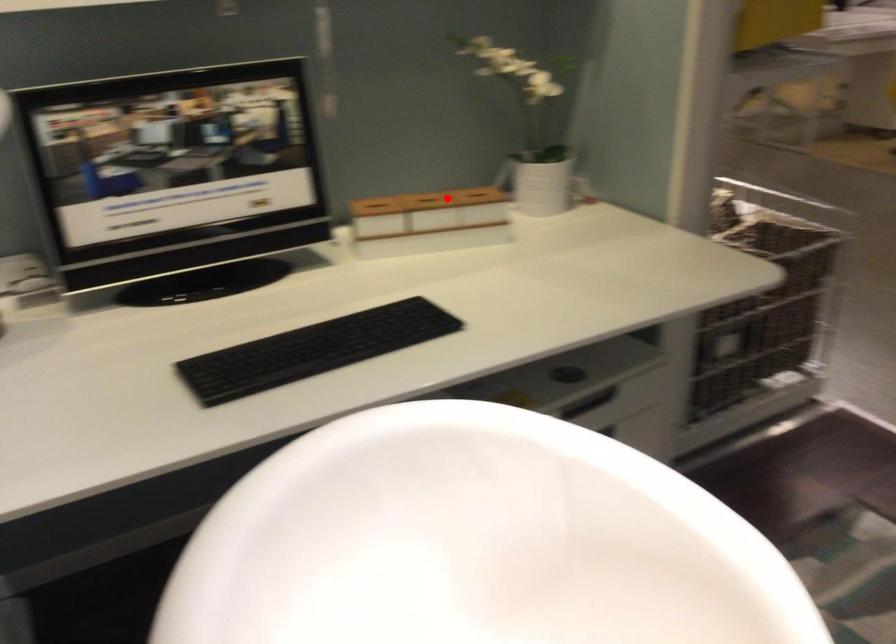
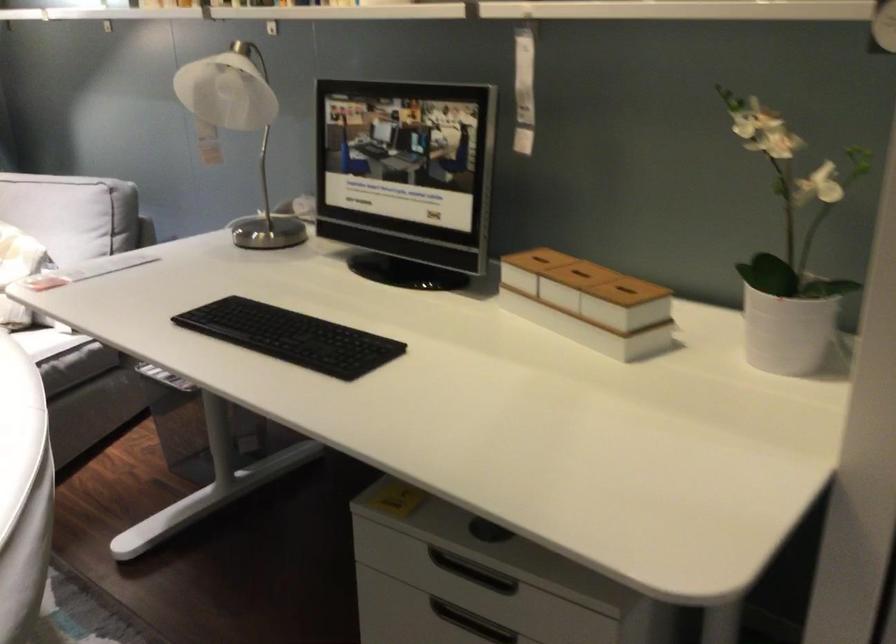
Find the pixel in the second image that matches the highlighted location in the first image.

(579, 275)